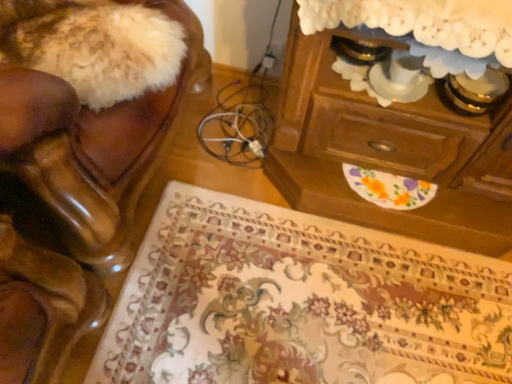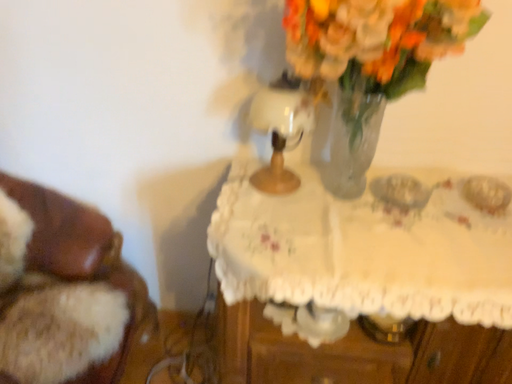
Question: Which way did the camera rotate in the video?

Choices:
 (A) rotated downward
 (B) rotated upward

Answer: (B)